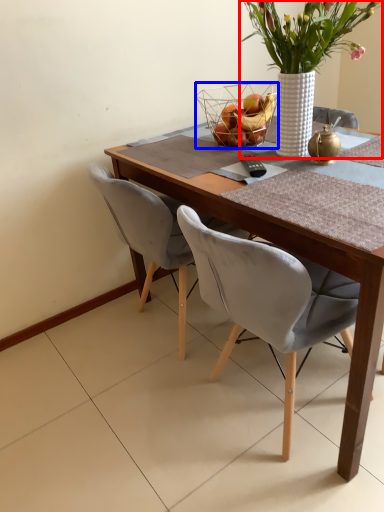
Question: Which point is further to the camera, houseplant (highlighted by a red box) or basket (highlighted by a blue box)?

Choices:
 (A) houseplant
 (B) basket

Answer: (B)